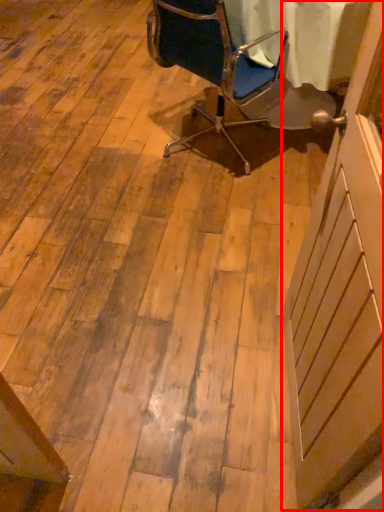
Question: From the image's perspective, what is the correct spatial positioning of screen door (annotated by the red box) in reference to chair?

Choices:
 (A) below
 (B) above

Answer: (A)